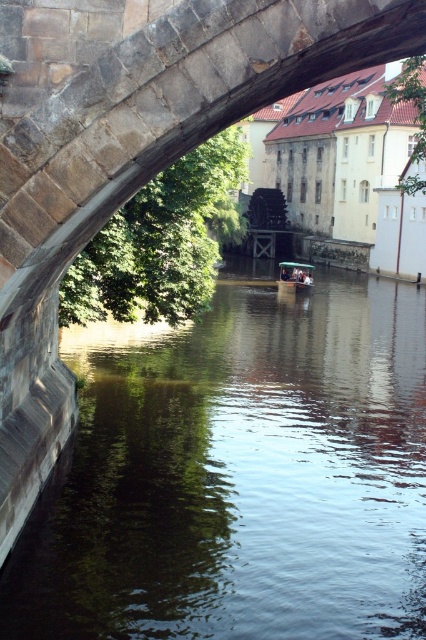
Looking at this image, who is taller, dark green water at center or wooden boat at center?

With more height is wooden boat at center.

Looking at this image, who is positioned more to the left, dark green water at center or wooden boat at center?

From the viewer's perspective, dark green water at center appears more on the left side.

Does point (363, 605) come closer to viewer compared to point (311, 285)?

Yes.

The height and width of the screenshot is (640, 426). I want to click on dark green water at center, so click(238, 476).